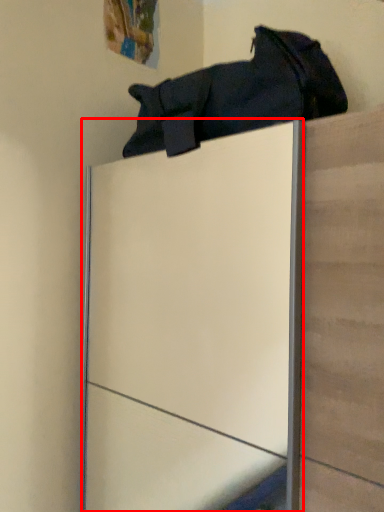
Question: Observing the image, what is the correct spatial positioning of glass door (annotated by the red box) in reference to footwear?

Choices:
 (A) right
 (B) left

Answer: (A)